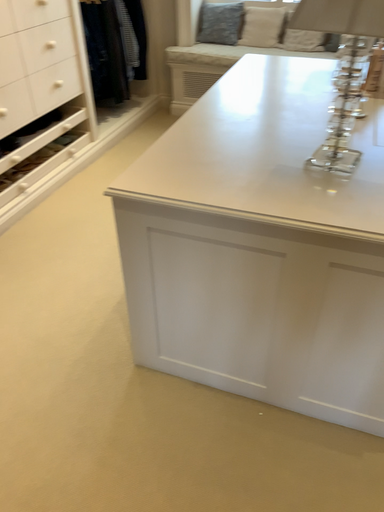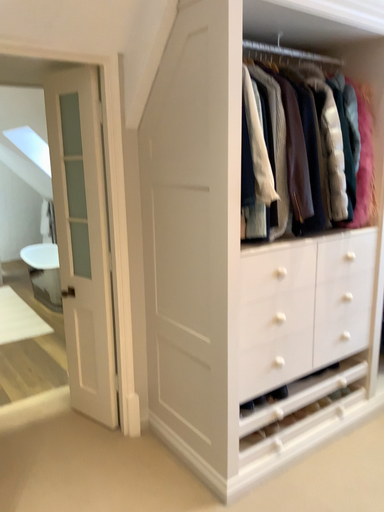
Question: How did the camera likely rotate when shooting the video?

Choices:
 (A) rotated left
 (B) rotated right

Answer: (A)